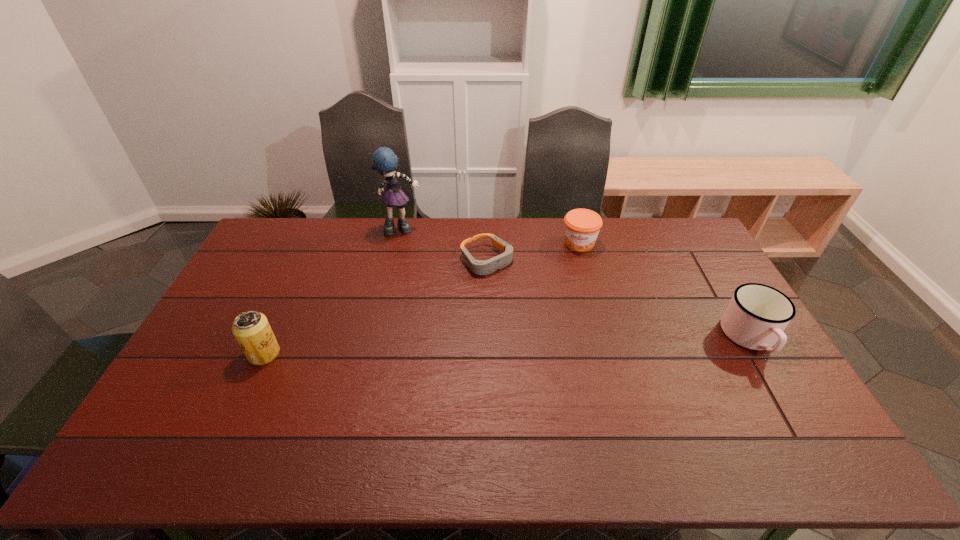
Image resolution: width=960 pixels, height=540 pixels. Identify the location of object that is the fourth closest to the shortest object. (757, 315).